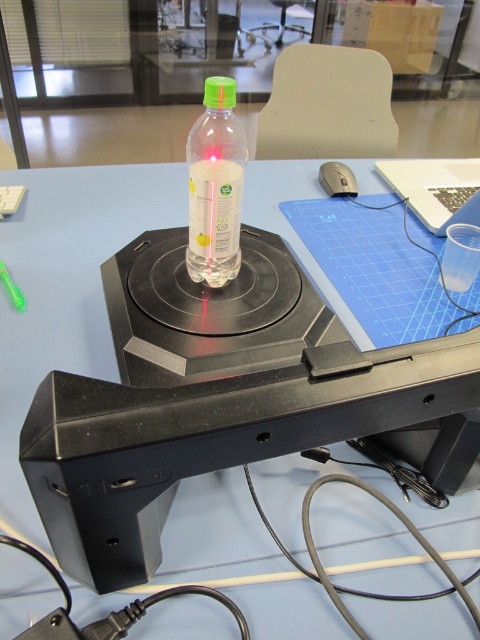
Question: Does translucent plastic bottle at center lie behind black plastic mouse at right?

Choices:
 (A) no
 (B) yes

Answer: (A)

Question: Can you confirm if translucent plastic bottle at center is positioned below black plastic mouse at right?

Choices:
 (A) yes
 (B) no

Answer: (A)

Question: Among these objects, which one is nearest to the camera?

Choices:
 (A) black plastic mouse at right
 (B) translucent plastic bottle at center

Answer: (B)

Question: Does translucent plastic bottle at center have a smaller size compared to black plastic mouse at right?

Choices:
 (A) yes
 (B) no

Answer: (B)